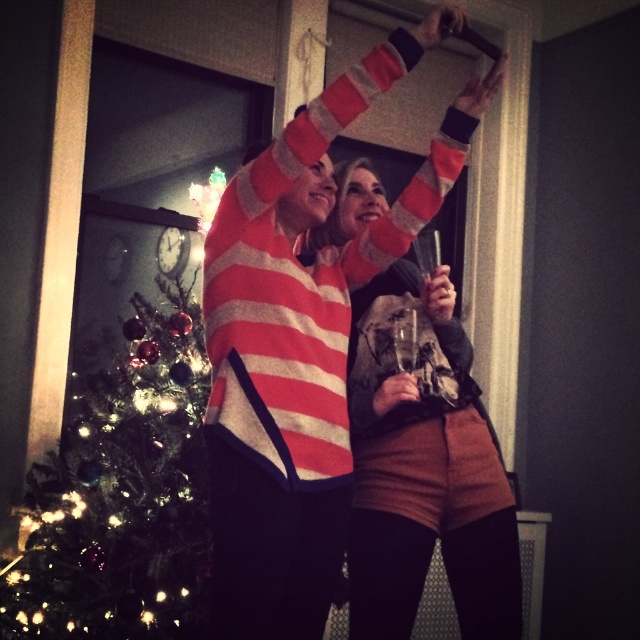
From the picture: You are standing in the room and want to place a small decoration on the green textured christmas tree at left. The point you need to place it at is located at coordinates point [122,496]. Is this point on the green textured christmas tree at left?

Yes, the point [122,496] is on the green textured christmas tree at left according to the description.

You are at a holiday party and want to take a photo of the green textured christmas tree at left and the striped sweater at center. Which object should you focus on first if you want to capture both in the same frame?

The green textured christmas tree at left is located below striped sweater at center, so you should focus on the striped sweater at center first to ensure both are in the frame.

You are at a holiday party and want to take a photo with the green textured christmas tree at left and the striped sweater at center. Which object is taller so it can be fully visible in the photo?

The striped sweater at center is taller than the green textured christmas tree at left, so it will be fully visible in the photo.